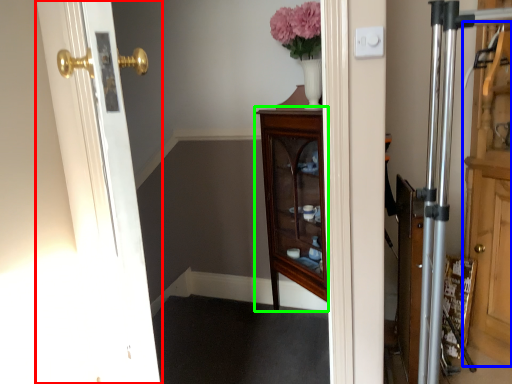
Question: Which is nearer to the door (highlighted by a red box)? dresser (highlighted by a blue box) or furniture (highlighted by a green box).

Choices:
 (A) dresser
 (B) furniture

Answer: (B)